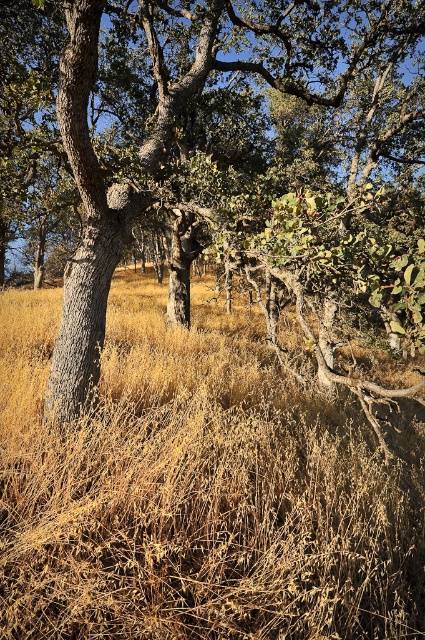
You are standing at the edge of the oak grove and want to take a photo of the smooth bark tree at center. If your camera has a focal length of 50mm and you want to capture the tree in full without moving closer, what is the minimum distance you should maintain from the tree to ensure it fits within the frame?

The smooth bark tree at center is 3.13 meters away from the camera. To capture it fully at 50mm focal length, maintaining this distance ensures the tree fits within the frame without needing to move closer.

You are standing in the middle of the oak grove and notice the smooth bark tree at center and the dry grass at center. Which object is closer to you?

The smooth bark tree at center is closer to you because the dry grass at center is behind it.

You are standing in the grove of oak trees and want to walk from the point at coordinates point (243, 32) to the point at coordinates point (320, 582). Which direction should you face to move towards the second point?

To move from point (243, 32) to point (320, 582), you should face towards the northeast direction because the second point is located northeast of the first point.